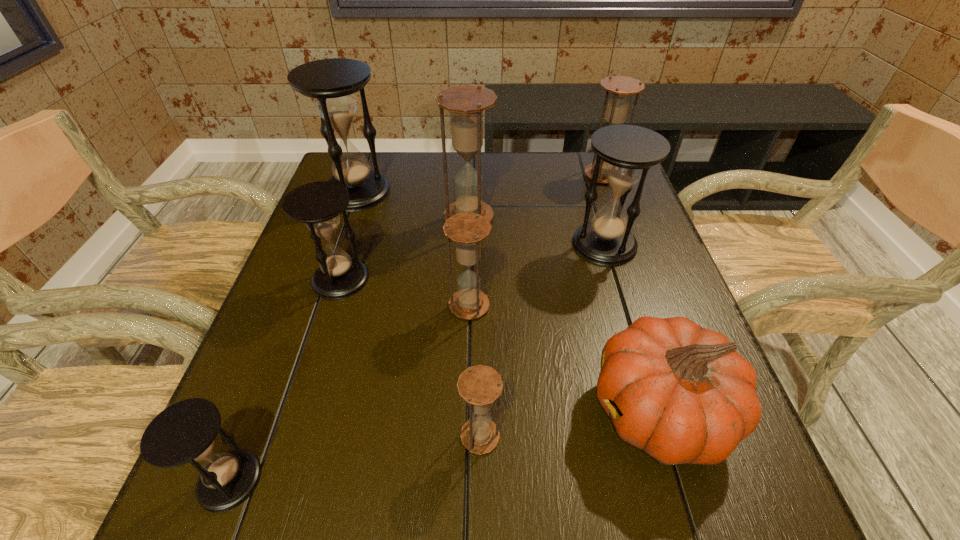
Locate an element on the screen. the biggest brown hourglass is located at coordinates (466, 103).

The height and width of the screenshot is (540, 960). I want to click on the biggest black hourglass, so click(332, 82).

At what (x,y) coordinates should I click in order to perform the action: click on the rightmost brown hourglass. Please return your answer as a coordinate pair (x, y). The width and height of the screenshot is (960, 540). Looking at the image, I should click on (620, 88).

This screenshot has width=960, height=540. Find the location of `the farthest brown hourglass`. the farthest brown hourglass is located at coordinates (620, 88).

Where is `the rightmost black hourglass`? the rightmost black hourglass is located at coordinates point(629,151).

The height and width of the screenshot is (540, 960). What are the coordinates of `the second smallest black hourglass` in the screenshot? It's located at (319, 204).

This screenshot has height=540, width=960. Identify the location of the second nearest brown hourglass. (467, 230).

The width and height of the screenshot is (960, 540). Identify the location of orange pumpkin. (681, 393).

You are a GUI agent. You are given a task and a screenshot of the screen. Output one action in this format:
    pyautogui.click(x=<x>, y=<y>)
    Task: Click on the nearest brown hourglass
    The image size is (960, 540).
    Given the screenshot: What is the action you would take?
    pyautogui.click(x=480, y=386)

Locate an element on the screen. This screenshot has height=540, width=960. the nearest black hourglass is located at coordinates (185, 432).